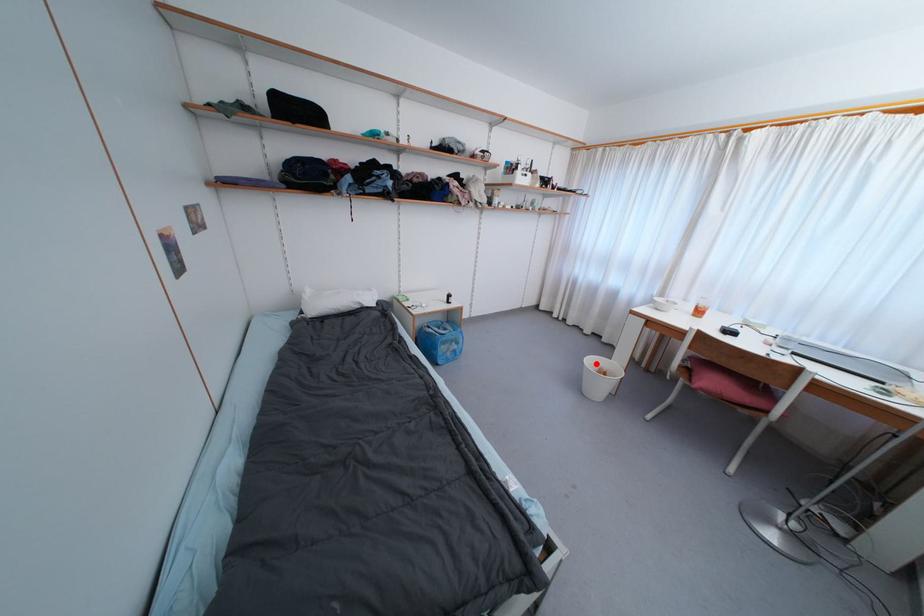
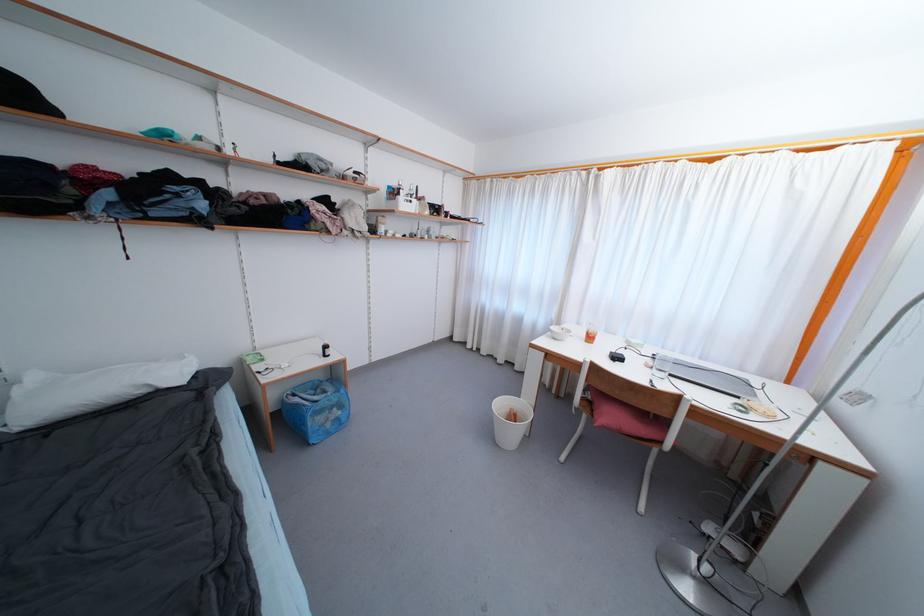
Locate, in the second image, the point that corresponds to the highlighted location in the first image.

(505, 407)